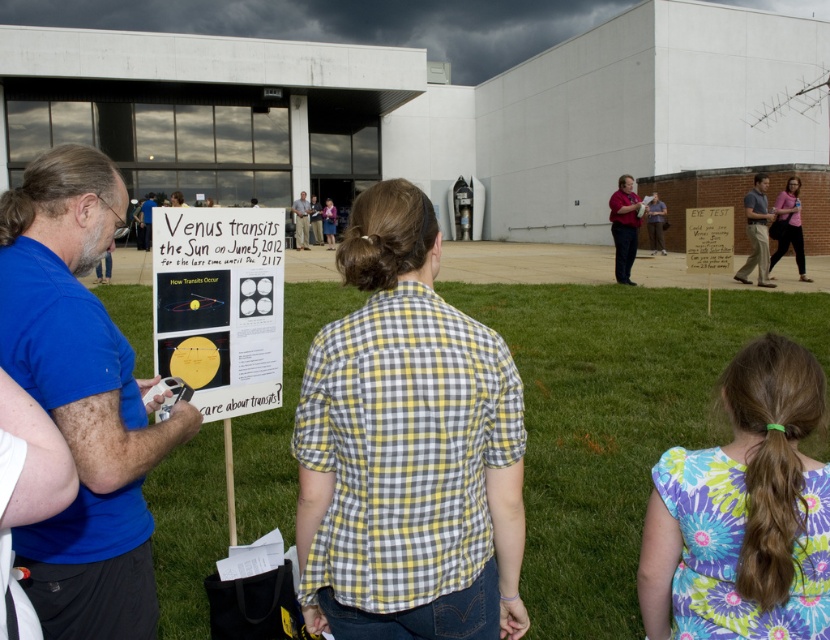
Which of these two, yellow checkered shirt at center or yellow plaid shirt at center, stands shorter?

With less height is yellow checkered shirt at center.

In the scene shown: Is yellow checkered shirt at center above yellow plaid shirt at center?

Incorrect, yellow checkered shirt at center is not positioned above yellow plaid shirt at center.

Between point (496, 419) and point (332, 234), which one is positioned behind?

Positioned behind is point (332, 234).

Where is `yellow checkered shirt at center`? The height and width of the screenshot is (640, 830). yellow checkered shirt at center is located at coordinates (408, 448).

Is green grass at center taller than pink fabric shirt at center?

In fact, green grass at center may be shorter than pink fabric shirt at center.

Can you confirm if green grass at center is positioned above pink fabric shirt at center?

Incorrect, green grass at center is not positioned above pink fabric shirt at center.

Is point (242, 497) closer to camera compared to point (777, 250)?

That is True.

This screenshot has height=640, width=830. I want to click on green grass at center, so click(614, 420).

Does yellow checkered shirt at center have a smaller size compared to matte black shirt at center?

Indeed, yellow checkered shirt at center has a smaller size compared to matte black shirt at center.

Is point (516, 426) positioned in front of point (295, 241)?

Yes, point (516, 426) is closer to viewer.

You are a GUI agent. You are given a task and a screenshot of the screen. Output one action in this format:
    pyautogui.click(x=<x>, y=<y>)
    Task: Click on the yellow checkered shirt at center
    The height and width of the screenshot is (640, 830).
    Given the screenshot: What is the action you would take?
    pyautogui.click(x=408, y=448)